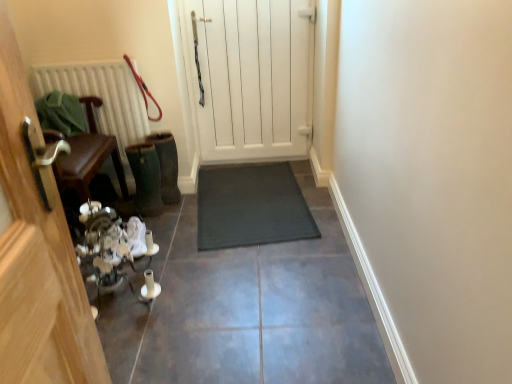
Question: Is wooden chair at left, which is the first door in left-to-right order, positioned before red leather leash at upper left?

Choices:
 (A) yes
 (B) no

Answer: (A)

Question: Does wooden chair at left, the second door from the right, appear on the right side of red leather leash at upper left?

Choices:
 (A) no
 (B) yes

Answer: (A)

Question: Is wooden chair at left, which is the second door from back to front, at the left side of red leather leash at upper left?

Choices:
 (A) no
 (B) yes

Answer: (B)

Question: Considering the relative sizes of wooden chair at left, which is the first door in left-to-right order, and red leather leash at upper left in the image provided, is wooden chair at left, which is the first door in left-to-right order, thinner than red leather leash at upper left?

Choices:
 (A) yes
 (B) no

Answer: (B)

Question: Does wooden chair at left, acting as the first door starting from the front, touch red leather leash at upper left?

Choices:
 (A) yes
 (B) no

Answer: (B)

Question: Is wooden chair at left, which is the second door from back to front, located outside red leather leash at upper left?

Choices:
 (A) yes
 (B) no

Answer: (A)

Question: Does red leather leash at upper left lie in front of white wooden door at center, marked as the 2th door in a left-to-right arrangement?

Choices:
 (A) no
 (B) yes

Answer: (B)

Question: From the image's perspective, is red leather leash at upper left over white wooden door at center, which appears as the second door when viewed from the front?

Choices:
 (A) no
 (B) yes

Answer: (A)

Question: Does red leather leash at upper left have a lesser height compared to white wooden door at center, positioned as the first door in back-to-front order?

Choices:
 (A) no
 (B) yes

Answer: (B)

Question: From the image's perspective, is red leather leash at upper left under white wooden door at center, arranged as the 1th door when viewed from the right?

Choices:
 (A) yes
 (B) no

Answer: (A)

Question: Does red leather leash at upper left appear on the right side of white wooden door at center, arranged as the 1th door when viewed from the right?

Choices:
 (A) yes
 (B) no

Answer: (B)

Question: From a real-world perspective, is red leather leash at upper left under white wooden door at center, positioned as the first door in back-to-front order?

Choices:
 (A) yes
 (B) no

Answer: (B)

Question: Is red leather leash at upper left positioned before wooden chair at left, which is the first door in left-to-right order?

Choices:
 (A) no
 (B) yes

Answer: (A)